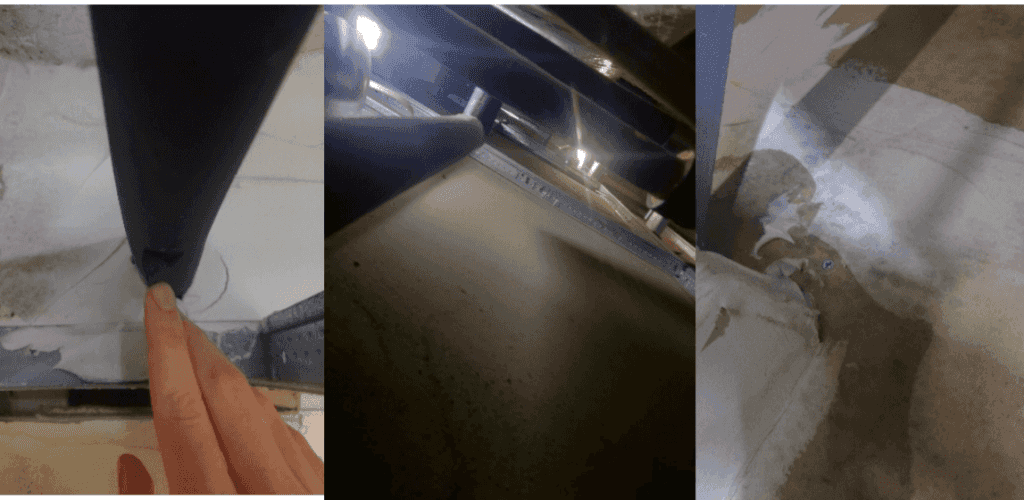
Where is `light brown wood plank`? The height and width of the screenshot is (500, 1024). light brown wood plank is located at coordinates (56, 465).